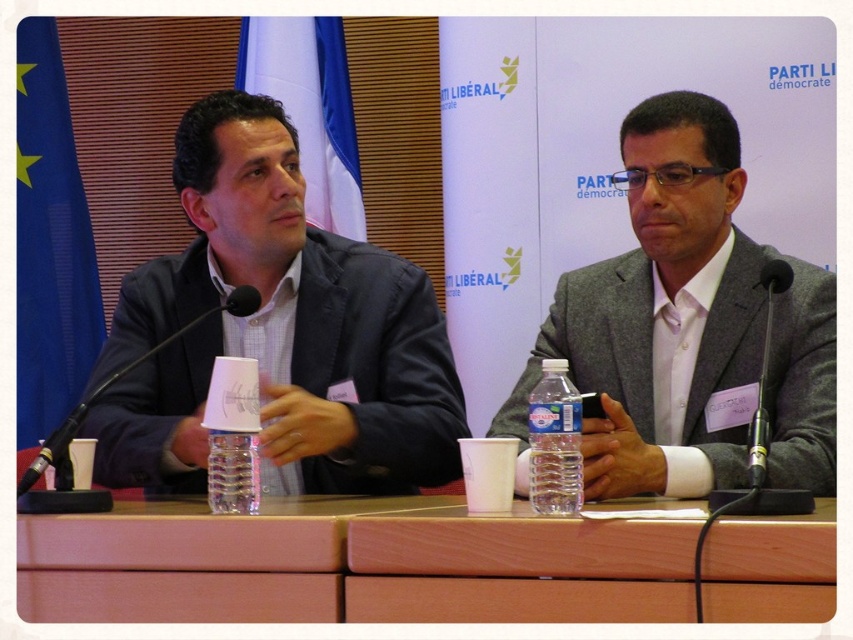
You are attending a press conference and notice the wooden table at center and the clear plastic water bottle at center. Can you determine which object is located higher in the image?

The clear plastic water bottle at center is positioned higher than the wooden table at center, so it is located higher in the image.

Looking at this image, you are a photographer at a press conference. You need to capture a closeup shot of the gray wool suit at center and the black matte microphone at left. Which object should you zoom in on first to ensure both are in frame?

The gray wool suit at center has a larger size compared to the black matte microphone at left, so you should zoom out first to include the larger gray wool suit at center, then adjust to include the smaller black matte microphone at left.